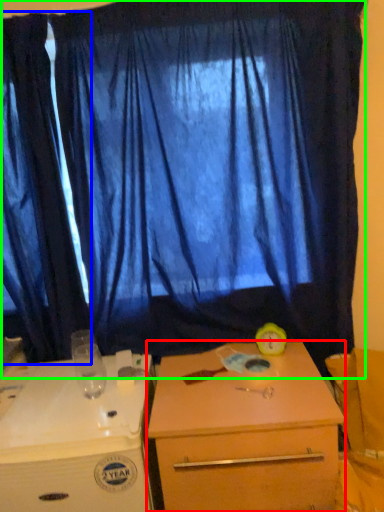
Question: Based on their relative distances, which object is nearer to desk (highlighted by a red box)? Choose from curtain (highlighted by a blue box) and curtain (highlighted by a green box).

Choices:
 (A) curtain
 (B) curtain

Answer: (B)